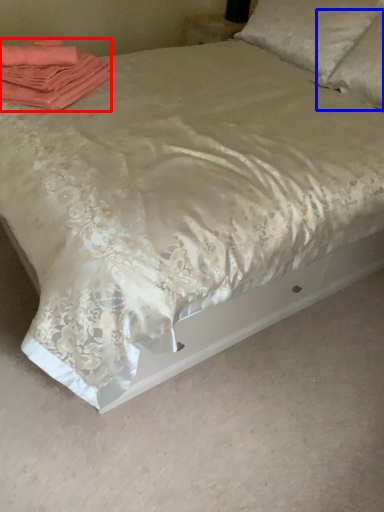
Question: Which point is further to the camera, material (highlighted by a red box) or pillow (highlighted by a blue box)?

Choices:
 (A) material
 (B) pillow

Answer: (B)